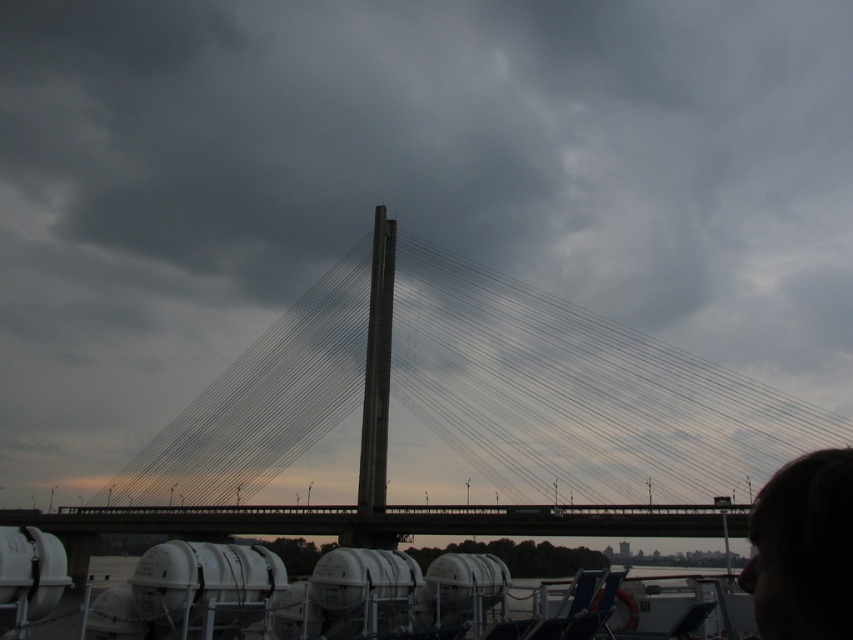
Question: Which point appears farthest from the camera in this image?

Choices:
 (A) (795, 556)
 (B) (438, 376)

Answer: (B)

Question: Does concrete bridge at center lie behind dark hair at upper right?

Choices:
 (A) yes
 (B) no

Answer: (A)

Question: Can you confirm if concrete bridge at center is bigger than dark hair at upper right?

Choices:
 (A) yes
 (B) no

Answer: (A)

Question: Is concrete bridge at center bigger than dark hair at upper right?

Choices:
 (A) no
 (B) yes

Answer: (B)

Question: Which point is closer to the camera taking this photo?

Choices:
 (A) (674, 440)
 (B) (798, 490)

Answer: (B)